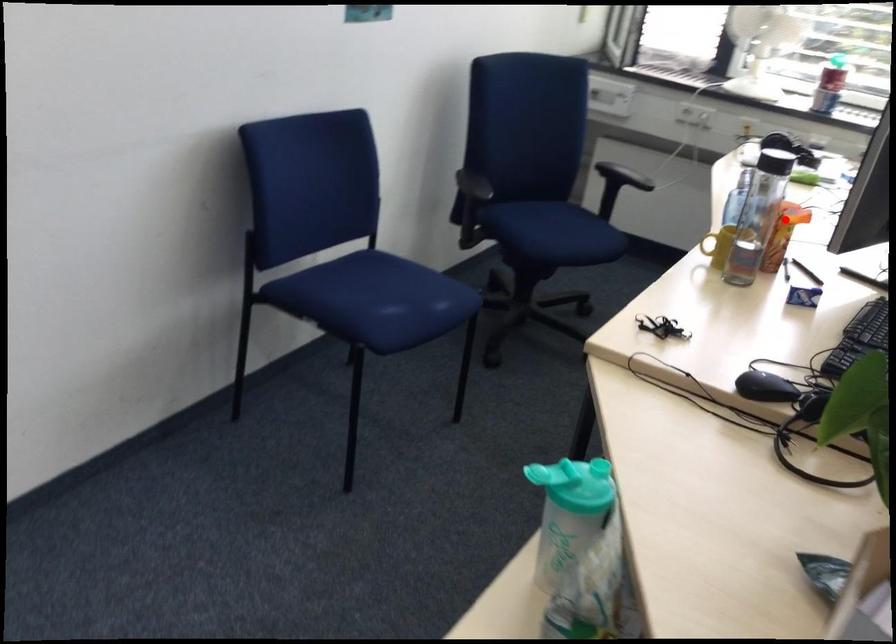
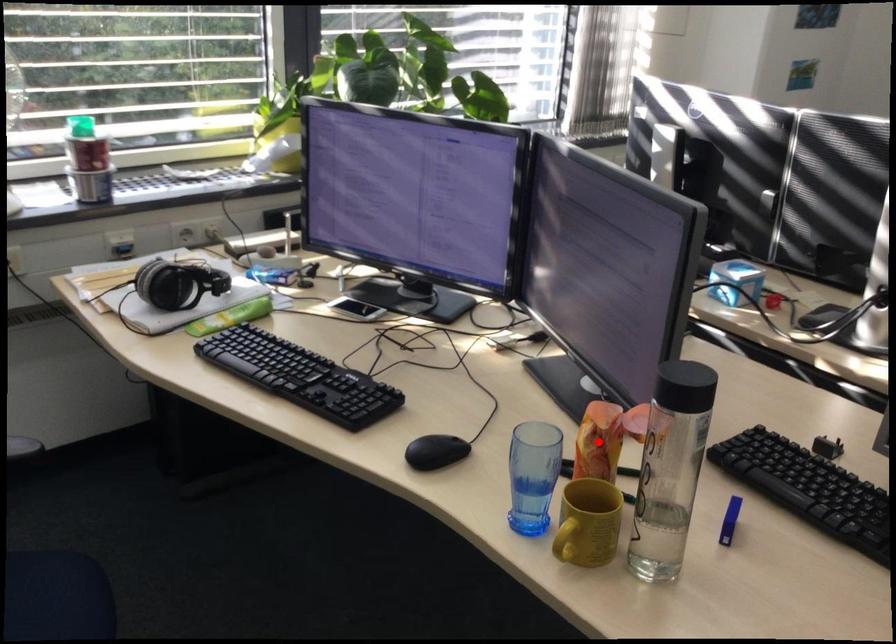
I am providing you with two images of the same scene from different viewpoints. A red point is marked on the first image and another point is marked on the second image. Do the highlighted points in image1 and image2 indicate the same real-world spot?

Yes